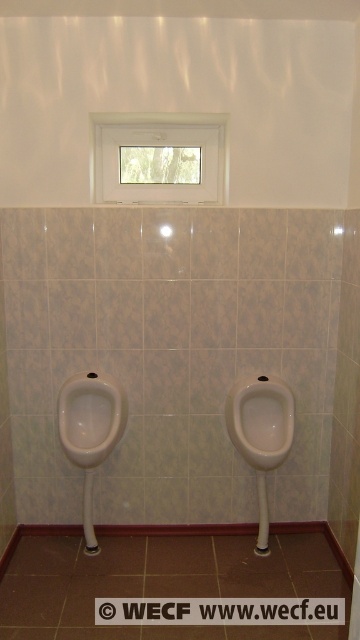
You are a maintenance worker in the restroom. You need to clean the urinals. The urinals are at point (91, 417). Which urinal should you clean first?

The point (91, 417) marks the white glossy urinal at left, so you should clean the white glossy urinal at left first.

You are a maintenance worker standing in the restroom and need to clean the white glossy urinal at left. If your cleaning spray can reach up to 2.5 meters, will you be able to reach it without moving closer?

The white glossy urinal at left is 2.51 meters away from the viewer. Since the spray can only reach up to 2.5 meters, you will not be able to reach it without moving closer.

You are a maintenance worker inspecting the restroom. You need to clean both the white glossy urinal at left and the white glossy urinal at center. Which one should you clean first if you want to start from the leftmost object?

The white glossy urinal at left is to the left of the white glossy urinal at center, so you should clean the white glossy urinal at left first.